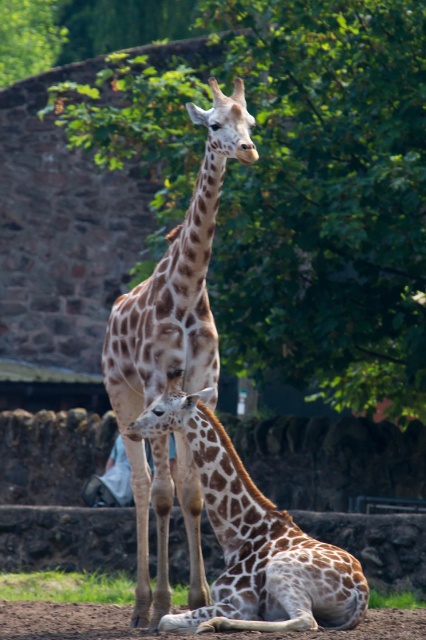
Question: Which of the following is the farthest from the observer?

Choices:
 (A) green leafy tree at upper center
 (B) brown sandy dirt at lower center

Answer: (A)

Question: Which object appears farthest from the camera in this image?

Choices:
 (A) brown sandy dirt at lower center
 (B) spotted fur giraffe at center

Answer: (A)

Question: Can you confirm if spotted fur giraffe at center is smaller than brown sandy dirt at lower center?

Choices:
 (A) yes
 (B) no

Answer: (B)

Question: Does spotted fur giraffe at center have a lesser width compared to brown spotted giraffe at center?

Choices:
 (A) yes
 (B) no

Answer: (A)

Question: Which is farther from the spotted fur giraffe at center?

Choices:
 (A) green leafy tree at upper center
 (B) brown spotted giraffe at center

Answer: (A)

Question: Considering the relative positions of spotted fur giraffe at center and brown sandy dirt at lower center in the image provided, where is spotted fur giraffe at center located with respect to brown sandy dirt at lower center?

Choices:
 (A) below
 (B) above

Answer: (B)